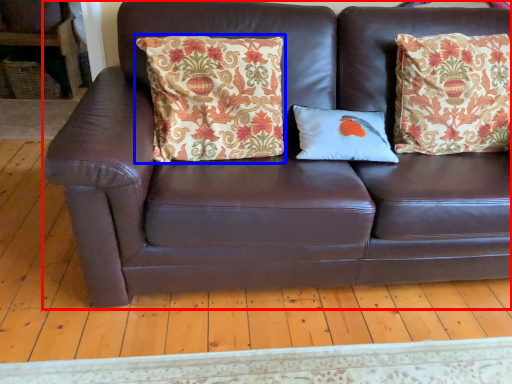
Question: Which point is further to the camera, studio couch (highlighted by a red box) or pillow (highlighted by a blue box)?

Choices:
 (A) studio couch
 (B) pillow

Answer: (B)